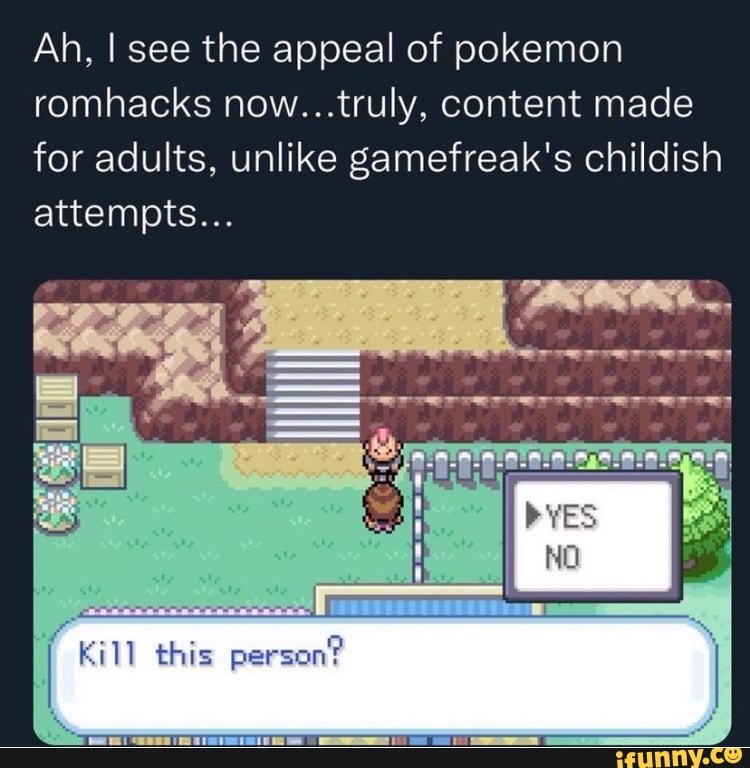
I want to click on stairs, so click(x=318, y=392).